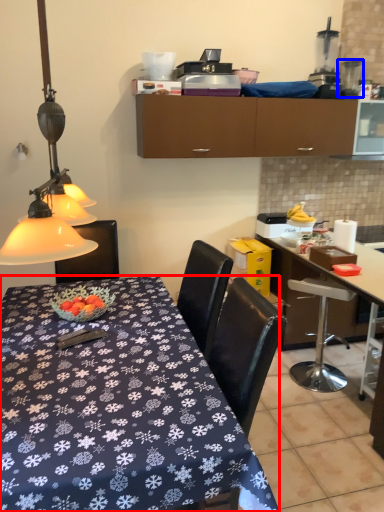
Question: Which point is further to the camera, desk (highlighted by a red box) or appliance (highlighted by a blue box)?

Choices:
 (A) desk
 (B) appliance

Answer: (B)